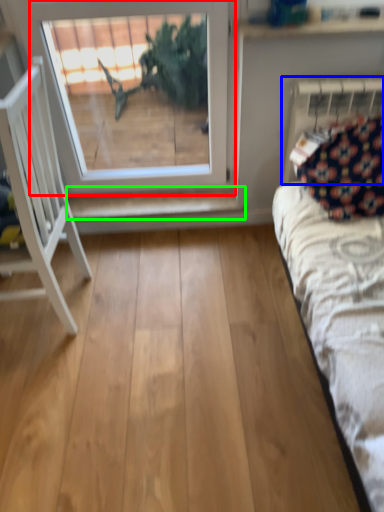
Question: Which is nearer to the window (highlighted by a red box)? radiator (highlighted by a blue box) or shelf (highlighted by a green box).

Choices:
 (A) radiator
 (B) shelf

Answer: (B)